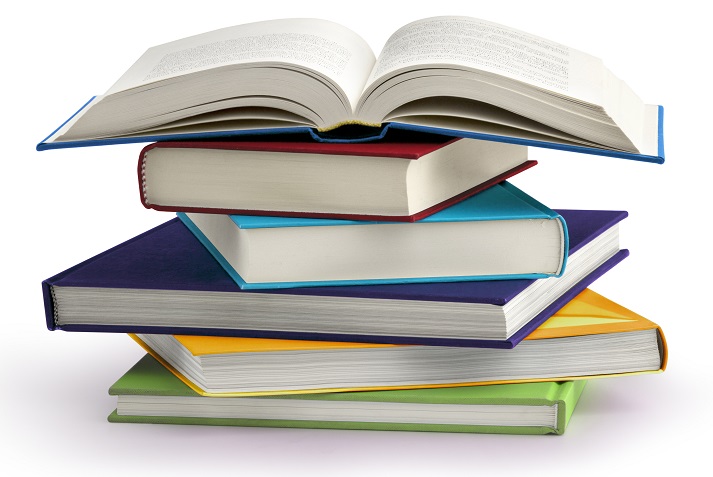
Identify the location of book covers. (394, 145), (478, 207), (159, 266), (588, 311), (150, 378).